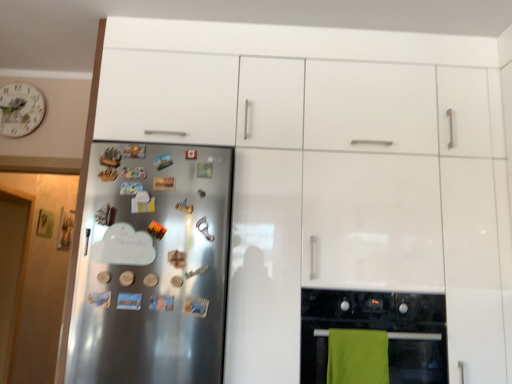
Question: Considering the relative positions of satin silver fridge at left and green fabric towel at lower center in the image provided, is satin silver fridge at left to the left or to the right of green fabric towel at lower center?

Choices:
 (A) left
 (B) right

Answer: (A)

Question: In terms of height, does satin silver fridge at left look taller or shorter compared to green fabric towel at lower center?

Choices:
 (A) tall
 (B) short

Answer: (A)

Question: Which is farther from the satin silver fridge at left?

Choices:
 (A) green fabric towel at lower center
 (B) black glass oven at lower right
 (C) white floral clock at upper left

Answer: (C)

Question: Which object is the closest to the white floral clock at upper left?

Choices:
 (A) green fabric towel at lower center
 (B) satin silver fridge at left
 (C) black glass oven at lower right

Answer: (B)